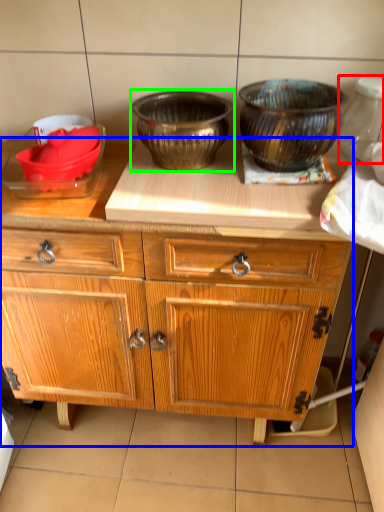
Question: Which is farther away from pottery (highlighted by a red box)? cabinetry (highlighted by a blue box) or bowl (highlighted by a green box)?

Choices:
 (A) cabinetry
 (B) bowl

Answer: (A)